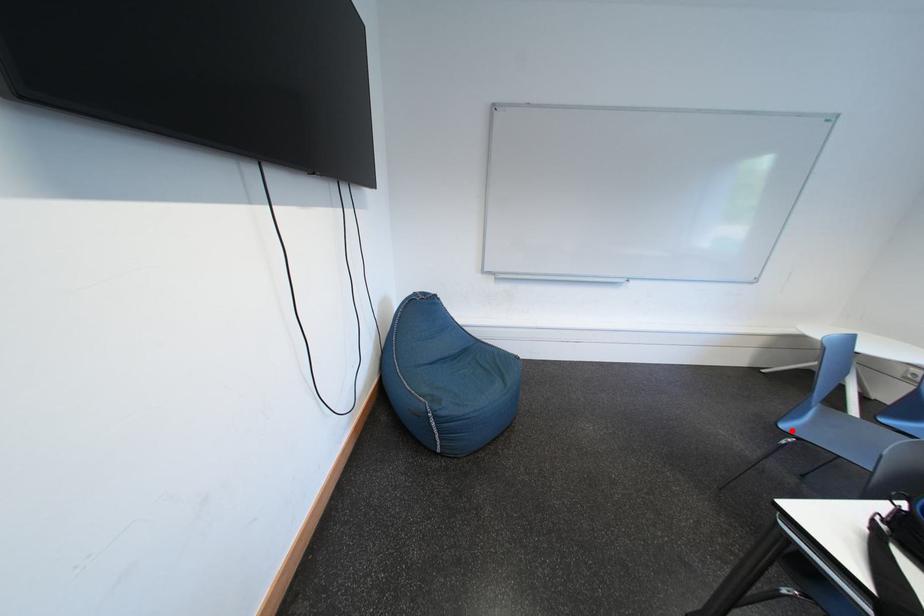
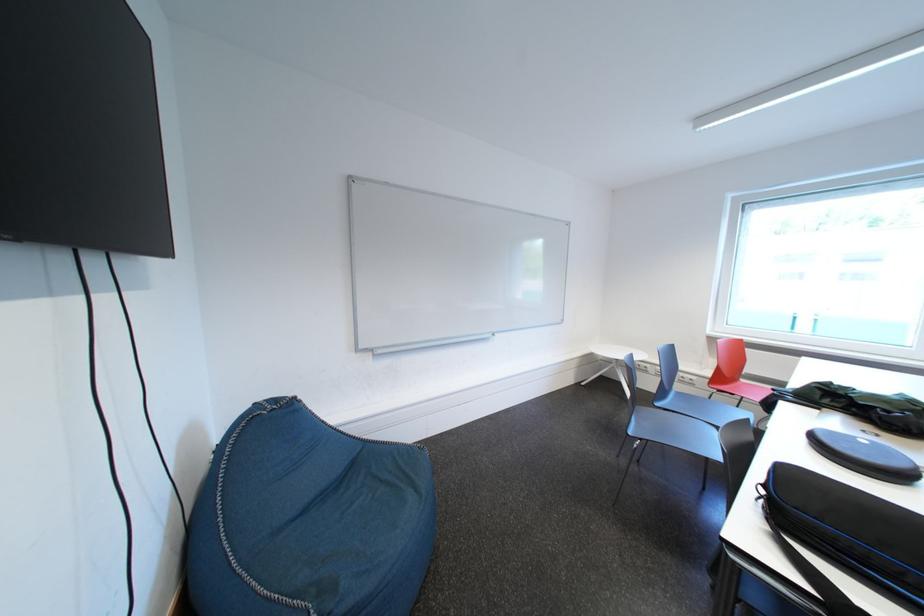
Question: I am providing you with two images of the same scene from different viewpoints. Given a red point in image1, look at the same physical point in image2. Is it:

Choices:
 (A) Closer to the viewpoint
 (B) Farther from the viewpoint

Answer: (A)